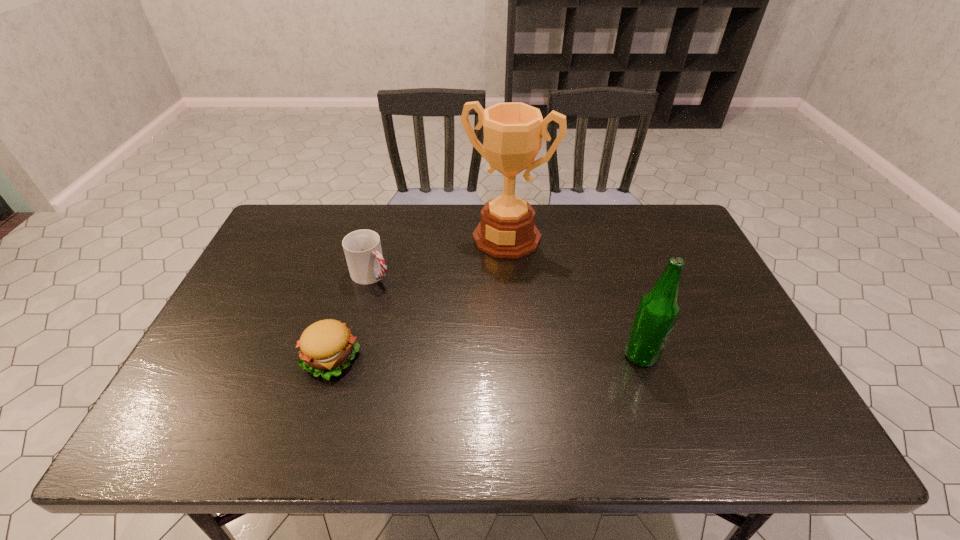
Identify the location of the shortest object. point(327,346).

This screenshot has height=540, width=960. I want to click on beer bottle, so click(658, 309).

Identify the location of the rightmost object. This screenshot has width=960, height=540. (658, 309).

Where is `the second shortest object`? This screenshot has height=540, width=960. the second shortest object is located at coordinates (362, 248).

Image resolution: width=960 pixels, height=540 pixels. What are the coordinates of `cup` in the screenshot? It's located at (362, 248).

Where is `award`? This screenshot has height=540, width=960. award is located at coordinates (513, 132).

Locate an element on the screen. the tallest object is located at coordinates (513, 132).

This screenshot has width=960, height=540. Find the location of `vacant space located 0.050m on the front of the shortest object`. vacant space located 0.050m on the front of the shortest object is located at coordinates (318, 403).

Identify the location of free space located on the label of the second tallest object. (732, 355).

Find the location of `free space located on the handle side of the cup`. free space located on the handle side of the cup is located at coordinates (424, 311).